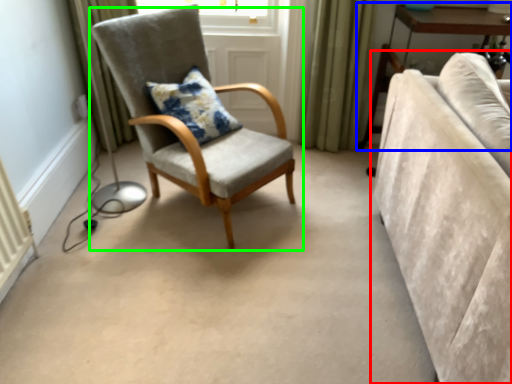
Question: Which object is the closest to the studio couch (highlighted by a red box)? Choose among these: table (highlighted by a blue box) or chair (highlighted by a green box).

Choices:
 (A) table
 (B) chair

Answer: (B)